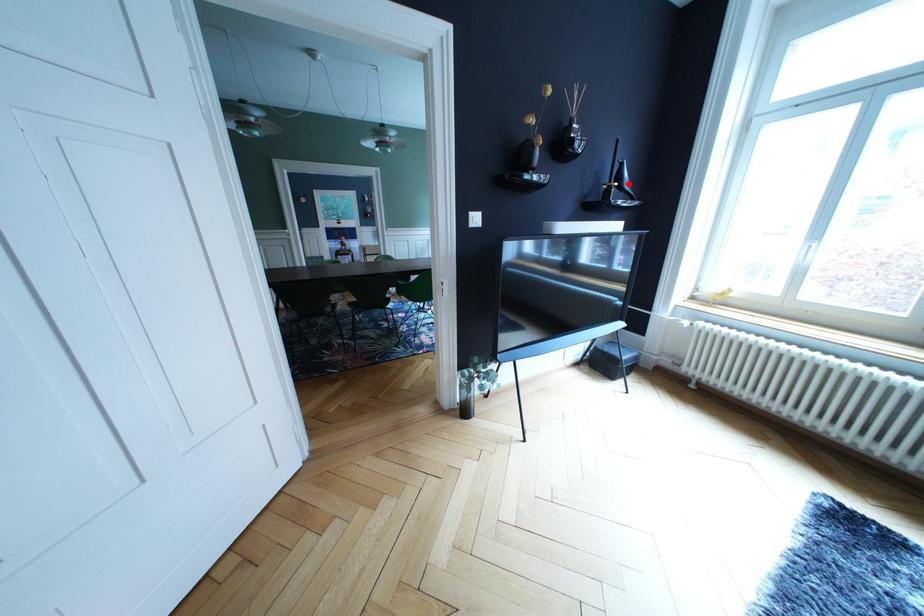
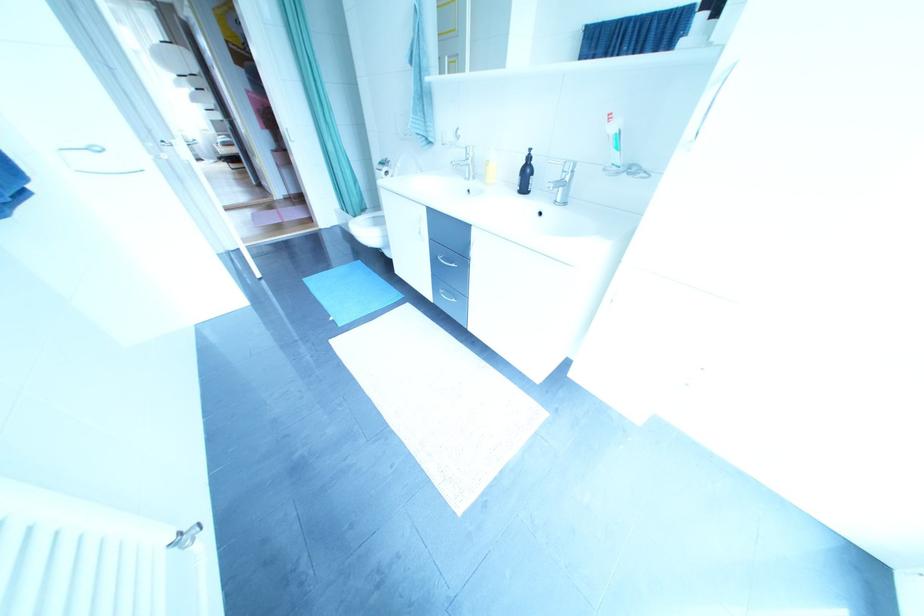
Question: I am providing you with two images of the same scene from different viewpoints. A red point is marked on the first image. Is the red point's position out of view in image 2?

Choices:
 (A) Yes
 (B) No

Answer: (A)